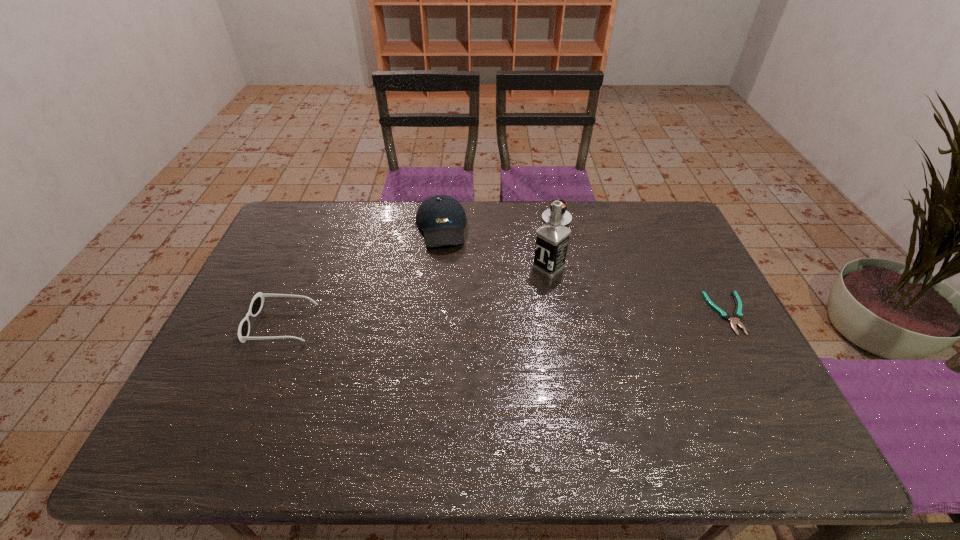
You are a GUI agent. You are given a task and a screenshot of the screen. Output one action in this format:
    pyautogui.click(x=<x>, y=<y>)
    Task: Click on the free space located on the front label of the vodka
    The height and width of the screenshot is (540, 960).
    Given the screenshot: What is the action you would take?
    pyautogui.click(x=462, y=339)

You are a GUI agent. You are given a task and a screenshot of the screen. Output one action in this format:
    pyautogui.click(x=<x>, y=<y>)
    Task: Click on the vacant point located 0.070m on the front label of the vodka
    This screenshot has width=960, height=540.
    Given the screenshot: What is the action you would take?
    pyautogui.click(x=524, y=288)

Find the location of `free space located 0.130m on the front label of the vodka`. free space located 0.130m on the front label of the vodka is located at coordinates (511, 299).

The width and height of the screenshot is (960, 540). I want to click on free region located 0.230m with the handle on the side of the cappuccino, so click(x=563, y=273).

What are the coordinates of `free space located with the handle on the side of the cappuccino` in the screenshot? It's located at (562, 266).

At what (x,y) coordinates should I click in order to perform the action: click on vacant space located with the handle on the side of the cappuccino. Please return your answer as a coordinate pair (x, y). The image size is (960, 540). Looking at the image, I should click on (561, 250).

Where is `free space located on the front-facing side of the second object from left to right`? The height and width of the screenshot is (540, 960). free space located on the front-facing side of the second object from left to right is located at coordinates (446, 279).

Find the location of a particular element. free space located on the front-facing side of the second object from left to right is located at coordinates (451, 310).

Find the location of a particular element. free space located 0.260m on the front-facing side of the second object from left to right is located at coordinates (451, 313).

At what (x,y) coordinates should I click in order to perform the action: click on cappuccino at the far edge. Please return your answer as a coordinate pair (x, y). Looking at the image, I should click on (566, 217).